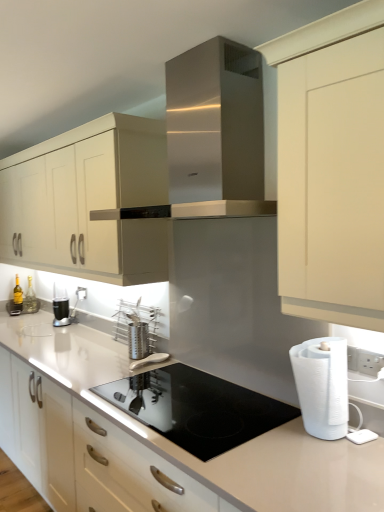
Find the location of `empty space that is ontop of satin silver utensil holder at center, placed as the 1th appliance when sorted from bottom to top (from a real-world perspective)`. empty space that is ontop of satin silver utensil holder at center, placed as the 1th appliance when sorted from bottom to top (from a real-world perspective) is located at coordinates (147, 358).